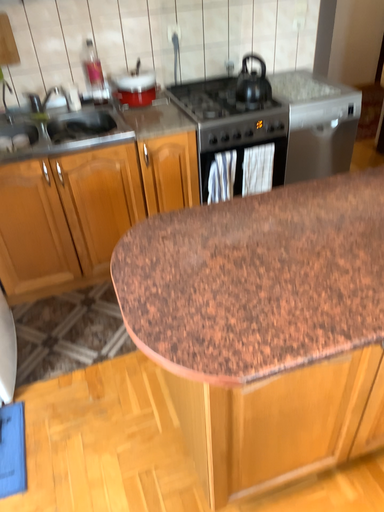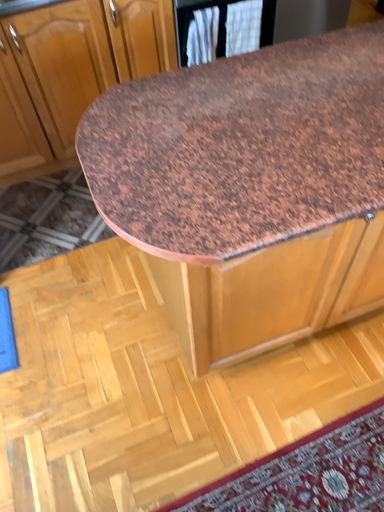
Question: Which way did the camera rotate in the video?

Choices:
 (A) rotated downward
 (B) rotated upward

Answer: (A)